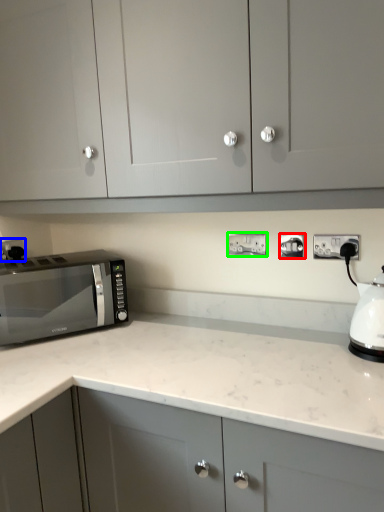
Question: Based on their relative distances, which object is farther from electric outlet (highlighted by a red box)? Choose from electric outlet (highlighted by a blue box) and electric outlet (highlighted by a green box).

Choices:
 (A) electric outlet
 (B) electric outlet

Answer: (A)